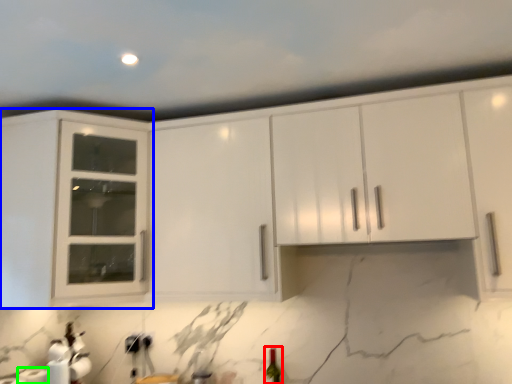
Question: Which object is the closest to the wine bottle (highlighted by a red box)? Choose among these: cabinetry (highlighted by a blue box) or paper towel (highlighted by a green box).

Choices:
 (A) cabinetry
 (B) paper towel

Answer: (B)